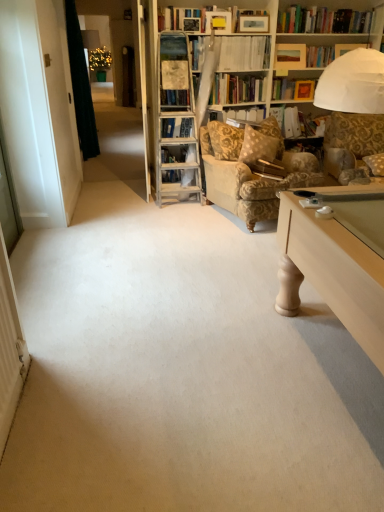
Question: From the image's perspective, is hardcover book at upper center, which is counted as the 2th book, starting from the front, above gold-patterned fabric armchair at center-right?

Choices:
 (A) yes
 (B) no

Answer: (A)

Question: From a real-world perspective, is hardcover book at upper center, the 2th book from the back, physically below gold-patterned fabric armchair at center-right?

Choices:
 (A) yes
 (B) no

Answer: (B)

Question: Is hardcover book at upper center, placed as the 1th book when sorted from top to bottom, oriented towards gold-patterned fabric armchair at center-right?

Choices:
 (A) yes
 (B) no

Answer: (B)

Question: From the image's perspective, is hardcover book at upper center, placed as the 1th book when sorted from top to bottom, beneath gold-patterned fabric armchair at center-right?

Choices:
 (A) yes
 (B) no

Answer: (B)

Question: Is hardcover book at upper center, placed as the 1th book when sorted from top to bottom, smaller than gold-patterned fabric armchair at center-right?

Choices:
 (A) yes
 (B) no

Answer: (A)

Question: Considering the positions of point (294, 113) and point (94, 139), is point (294, 113) closer or farther from the camera than point (94, 139)?

Choices:
 (A) farther
 (B) closer

Answer: (B)

Question: Looking at their shapes, would you say white paper folder at upper center, the 3th book when ordered from front to back, is wider or thinner than dark green fabric at left?

Choices:
 (A) wide
 (B) thin

Answer: (B)

Question: From a real-world perspective, is white paper folder at upper center, the 1th book viewed from the back, physically located above or below dark green fabric at left?

Choices:
 (A) above
 (B) below

Answer: (B)

Question: From their relative heights in the image, would you say white paper folder at upper center, acting as the second book starting from the bottom, is taller or shorter than dark green fabric at left?

Choices:
 (A) short
 (B) tall

Answer: (A)

Question: From a real-world perspective, is white paper folder at upper center, the 1th book viewed from the back, physically located above or below fluffy beige pillow at right?

Choices:
 (A) above
 (B) below

Answer: (A)

Question: From the image's perspective, relative to fluffy beige pillow at right, is white paper folder at upper center, which appears as the second book when viewed from the top, above or below?

Choices:
 (A) above
 (B) below

Answer: (A)

Question: Considering the positions of white paper folder at upper center, which appears as the second book when viewed from the top, and fluffy beige pillow at right in the image, is white paper folder at upper center, which appears as the second book when viewed from the top, wider or thinner than fluffy beige pillow at right?

Choices:
 (A) wide
 (B) thin

Answer: (B)

Question: Based on their sizes in the image, would you say white paper folder at upper center, acting as the second book starting from the bottom, is bigger or smaller than fluffy beige pillow at right?

Choices:
 (A) big
 (B) small

Answer: (A)

Question: Considering the positions of point (377, 163) and point (72, 82), is point (377, 163) closer or farther from the camera than point (72, 82)?

Choices:
 (A) closer
 (B) farther

Answer: (A)

Question: Based on their sizes in the image, would you say fluffy beige pillow at right is bigger or smaller than dark green fabric at left?

Choices:
 (A) big
 (B) small

Answer: (B)